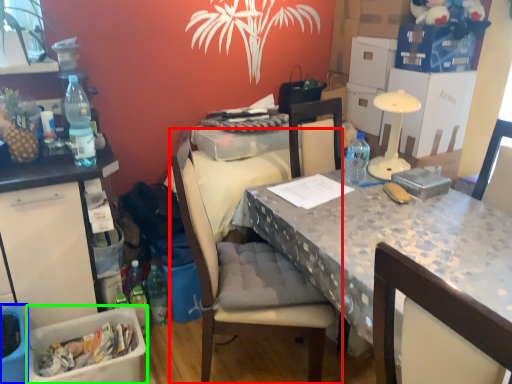
Question: Based on their relative distances, which object is nearer to chair (highlighted by a red box)? Choose from picnic basket (highlighted by a blue box) and box (highlighted by a green box).

Choices:
 (A) picnic basket
 (B) box

Answer: (B)